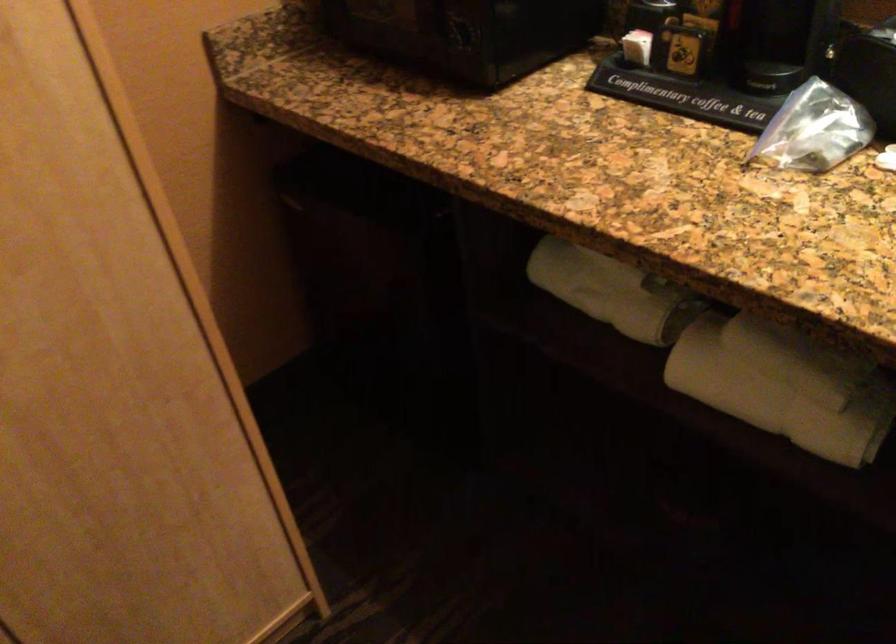
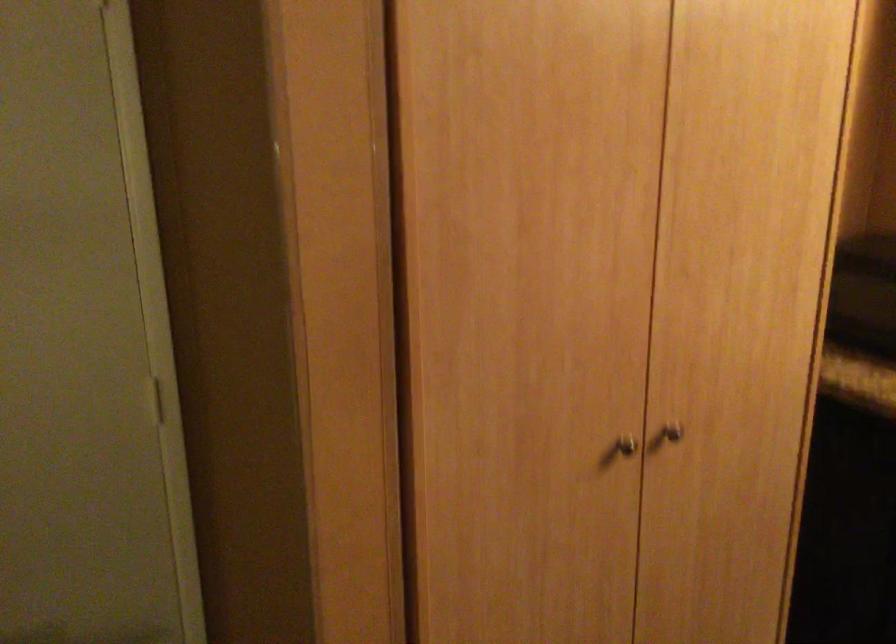
The first image is from the beginning of the video and the second image is from the end. How did the camera likely rotate when shooting the video?

The camera rotated toward left-up.